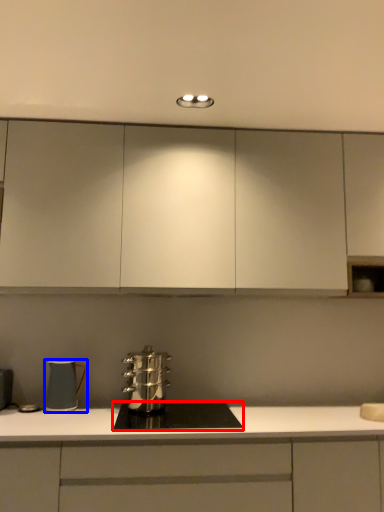
Question: Which point is further to the camera, home appliance (highlighted by a red box) or kitchen appliance (highlighted by a blue box)?

Choices:
 (A) home appliance
 (B) kitchen appliance

Answer: (B)